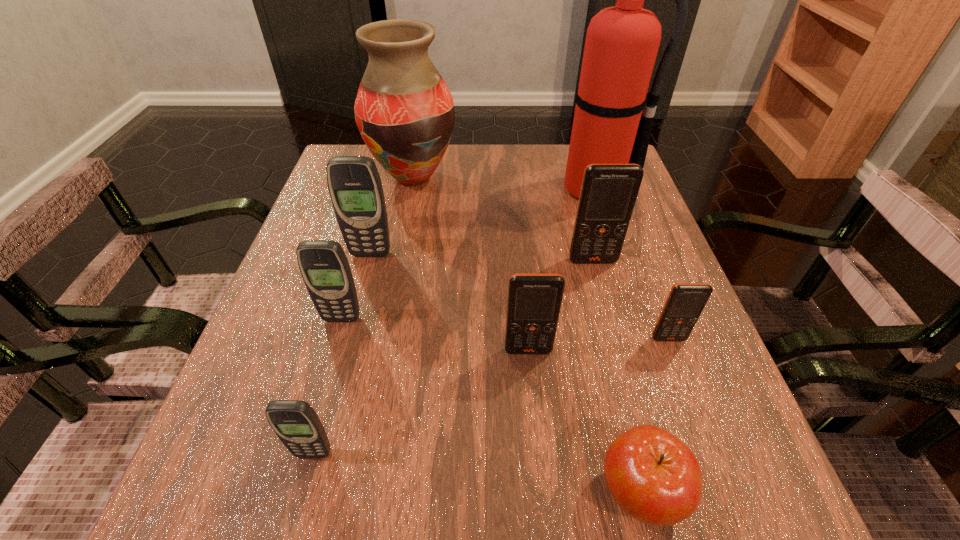
In the image, there is a desktop. Where is `vacant space at the far left corner`? This screenshot has width=960, height=540. vacant space at the far left corner is located at coordinates (360, 153).

The width and height of the screenshot is (960, 540). What are the coordinates of `vacant point located between the vase and the second cellular telephone from right to left` in the screenshot? It's located at (503, 219).

This screenshot has height=540, width=960. Find the location of `vacant area that lies between the second smallest gray cellular telephone and the seventh farthest object`. vacant area that lies between the second smallest gray cellular telephone and the seventh farthest object is located at coordinates (435, 334).

The image size is (960, 540). I want to click on free space between the fifth farthest object and the fifth object from left to right, so click(435, 334).

Where is `free space that is in between the third farthest cellular telephone and the tallest object`? free space that is in between the third farthest cellular telephone and the tallest object is located at coordinates (468, 253).

This screenshot has width=960, height=540. In order to click on free area in between the smallest orange cellular telephone and the nearest cellular telephone in this screenshot , I will do `click(492, 396)`.

The width and height of the screenshot is (960, 540). Find the location of `free spot between the rightmost orange cellular telephone and the red fire extinguisher`. free spot between the rightmost orange cellular telephone and the red fire extinguisher is located at coordinates (632, 264).

This screenshot has width=960, height=540. I want to click on free area in between the eighth shortest object and the tallest object, so click(x=504, y=183).

At what (x,y) coordinates should I click in order to perform the action: click on unoccupied position between the second nearest gray cellular telephone and the second orange cellular telephone from right to left. Please return your answer as a coordinate pair (x, y). The height and width of the screenshot is (540, 960). Looking at the image, I should click on (468, 289).

Image resolution: width=960 pixels, height=540 pixels. I want to click on vacant point located between the seventh farthest object and the fire extinguisher, so click(x=562, y=269).